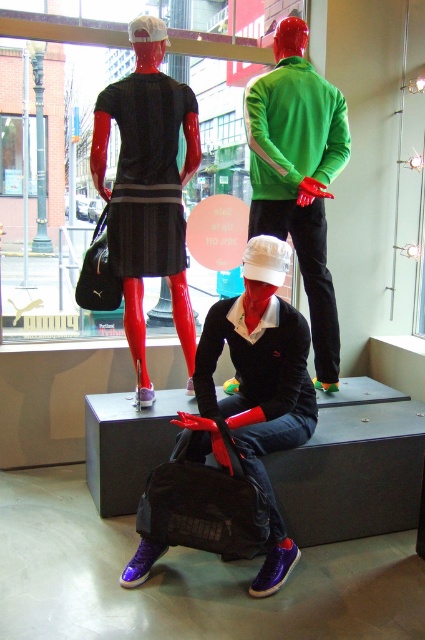
Is point (248, 301) in front of point (170, 138)?

That is True.

Is matte black duffel bag at center positioned behind matte black dress at center?

That is False.

Is point (292, 326) closer to viewer compared to point (172, 225)?

That is True.

Locate an element on the screen. The width and height of the screenshot is (425, 640). matte black duffel bag at center is located at coordinates (260, 385).

Between point (150, 106) and point (345, 129), which one is positioned in front?

Point (150, 106) is more forward.

Which is below, matte black dress at left or matte green jacket at upper center?

A: matte black dress at left is lower down.

The width and height of the screenshot is (425, 640). Describe the element at coordinates (147, 188) in the screenshot. I see `matte black dress at left` at that location.

Find the location of a particular element. matte black dress at left is located at coordinates (147, 188).

Does point (251, 460) come in front of point (328, 131)?

That is True.

Looking at this image, who is lower down, matte black duffel bag at center or matte green jacket at upper center?

Positioned lower is matte black duffel bag at center.

Which is behind, point (133, 579) or point (291, 220)?

Point (291, 220)

Where is `matte black duffel bag at center`? The width and height of the screenshot is (425, 640). matte black duffel bag at center is located at coordinates (260, 385).